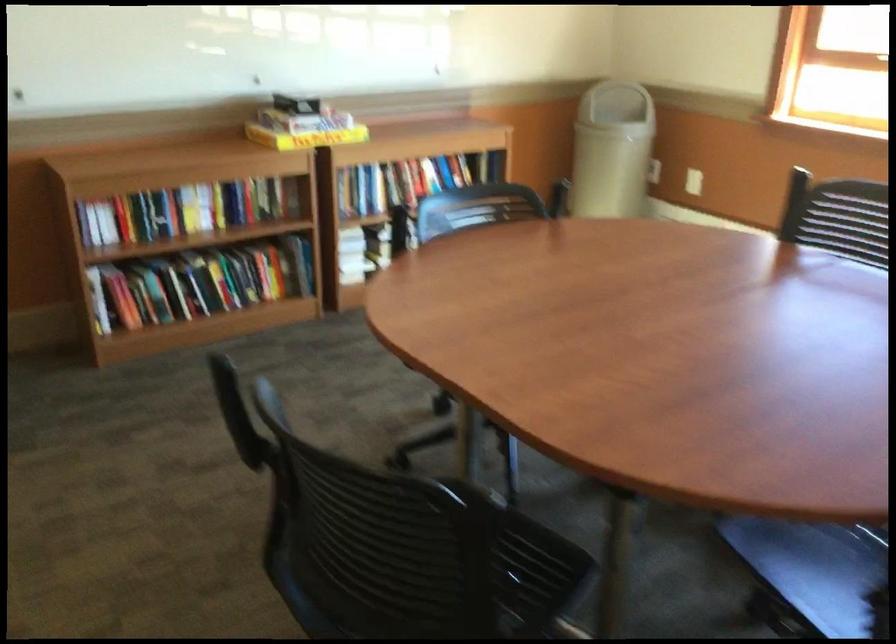
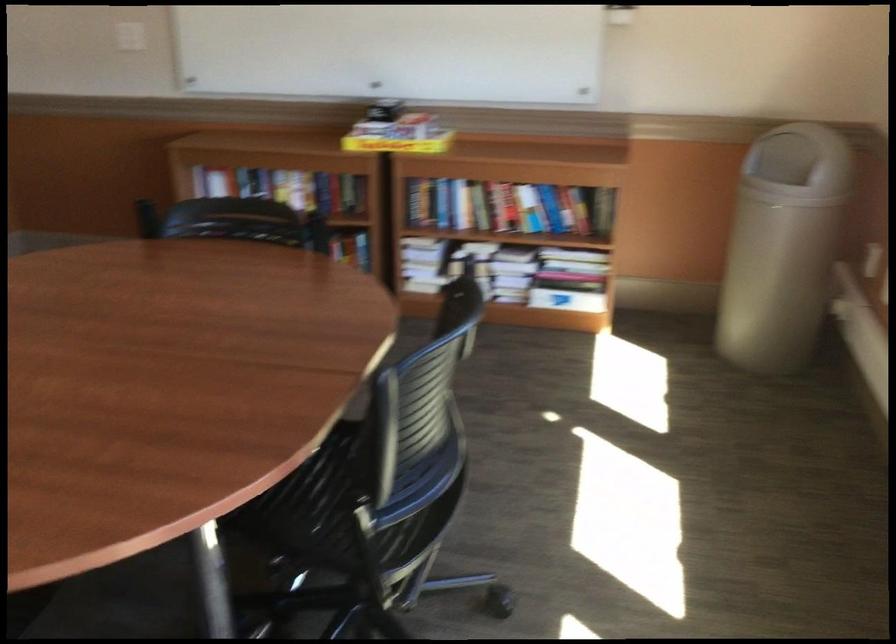
Find the pixel in the second image that matches [597,96] in the first image.

(798, 156)